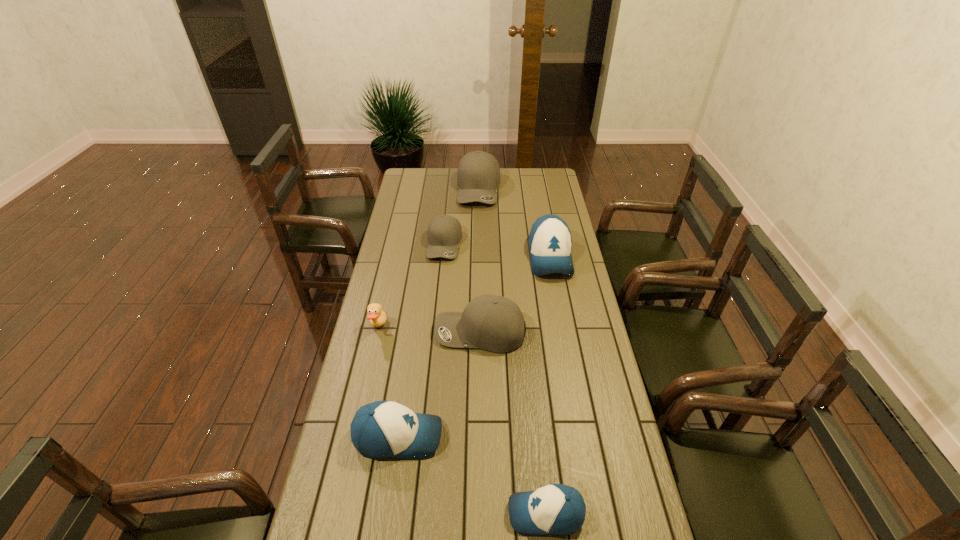
At what (x,y) coordinates should I click in order to perform the action: click on vacant space located 0.290m on the front-facing side of the nearest object. Please return your answer as a coordinate pair (x, y). Looking at the image, I should click on pos(396,514).

I want to click on blank area located on the front-facing side of the nearest object, so click(386, 514).

The image size is (960, 540). What are the coordinates of `object at the far edge` in the screenshot? It's located at (478, 175).

This screenshot has height=540, width=960. Identify the location of baseball cap that is at the left edge. (381, 429).

Identify the location of duck present at the left edge. The image size is (960, 540). (377, 317).

The height and width of the screenshot is (540, 960). What are the coordinates of `free spot at the left edge of the desktop` in the screenshot? It's located at (348, 471).

This screenshot has height=540, width=960. What are the coordinates of `blank space at the right edge of the desktop` in the screenshot? It's located at (571, 390).

Identify the location of free space between the second smallest blue baseball cap and the tan duck. The height and width of the screenshot is (540, 960). (388, 382).

Identify the location of free area in between the second biggest blue baseball cap and the smallest gray baseball cap. The image size is (960, 540). (421, 340).

The width and height of the screenshot is (960, 540). In order to click on vacant area between the farthest baseball cap and the tan duck in this screenshot , I will do `click(428, 258)`.